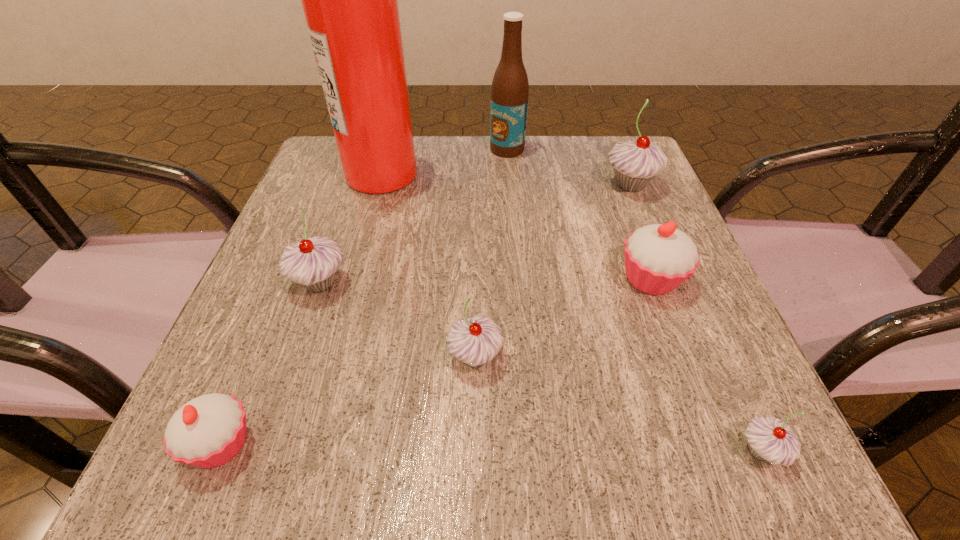
This screenshot has width=960, height=540. I want to click on the tallest object, so click(x=350, y=0).

In order to click on beer bottle in this screenshot , I will do `click(510, 89)`.

Locate an element on the screen. The image size is (960, 540). the farthest gray cupcake is located at coordinates (636, 163).

Find the location of a particular element. This screenshot has width=960, height=540. the sixth shortest object is located at coordinates (636, 163).

Where is `the leftmost gray cupcake`? The width and height of the screenshot is (960, 540). the leftmost gray cupcake is located at coordinates (313, 263).

Find the location of a particular element. the second tallest cupcake is located at coordinates (313, 263).

You are a GUI agent. You are given a task and a screenshot of the screen. Output one action in this format:
    pyautogui.click(x=<x>, y=<y>)
    Task: Click on the right pink cupcake
    Image resolution: width=960 pixels, height=540 pixels.
    Given the screenshot: What is the action you would take?
    pyautogui.click(x=658, y=258)

In order to click on the bigger pink cupcake in this screenshot , I will do `click(658, 258)`.

Find the location of `the third biggest gray cupcake`. the third biggest gray cupcake is located at coordinates (475, 341).

The height and width of the screenshot is (540, 960). What are the coordinates of `the second gray cupcake from left to right` in the screenshot? It's located at (475, 341).